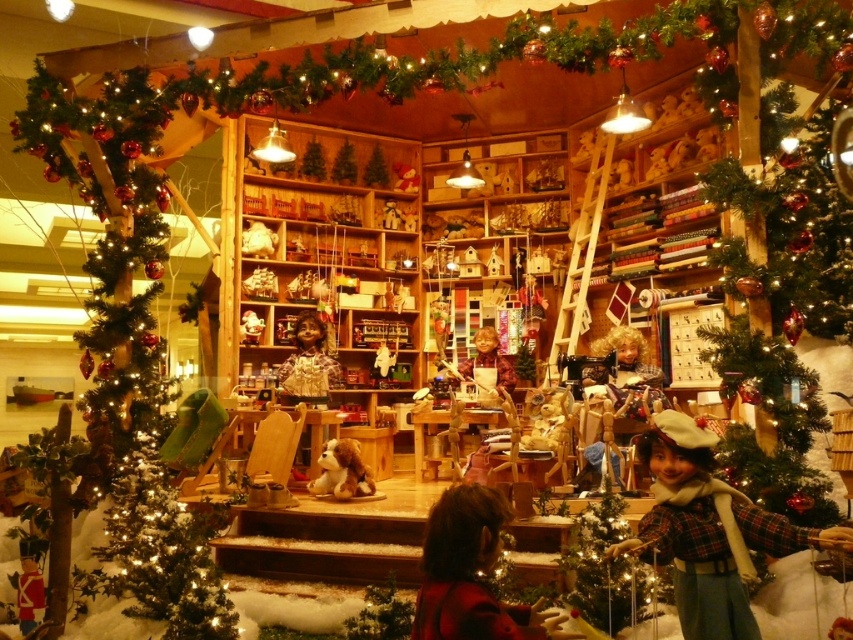
You are a customer in a store looking at the festive display. You want to pick up the fluffy brown plush at center but need to reach it without disturbing the brown woolen sweater at lower center. Is the sweater in your way?

The brown woolen sweater at lower center is located above the fluffy brown plush at center, so the sweater is blocking your access to the plush. You will need to move the sweater first to reach the plush.

You are standing in front of the festive display and want to touch the two points mentioned. Which point, point (113, 474) or point (328, 365), is closer to you?

Point (113, 474) is closer to the camera than point (328, 365), so it is closer to you.

You are a store manager arranging a holiday display. You have a green textured christmas tree at left and a wooden doll at center. Which object is wider?

The green textured christmas tree at left is wider than the wooden doll at center.